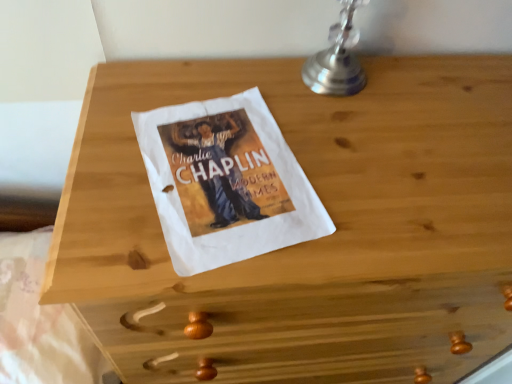
Question: Should I look upward or downward to see white paper at lower center?

Choices:
 (A) down
 (B) up

Answer: (A)

Question: Is white paper at lower center touching silver metallic table lamp at upper right?

Choices:
 (A) yes
 (B) no

Answer: (B)

Question: From the image's perspective, is white paper at lower center below silver metallic table lamp at upper right?

Choices:
 (A) no
 (B) yes

Answer: (B)

Question: From the image's perspective, is white paper at lower center on silver metallic table lamp at upper right?

Choices:
 (A) no
 (B) yes

Answer: (A)

Question: Can you confirm if white paper at lower center is bigger than silver metallic table lamp at upper right?

Choices:
 (A) yes
 (B) no

Answer: (A)

Question: Is there a large distance between white paper at lower center and silver metallic table lamp at upper right?

Choices:
 (A) no
 (B) yes

Answer: (A)

Question: Is white paper at lower center smaller than silver metallic table lamp at upper right?

Choices:
 (A) no
 (B) yes

Answer: (A)

Question: Is the depth of silver metallic table lamp at upper right greater than that of white paper at lower center?

Choices:
 (A) yes
 (B) no

Answer: (B)

Question: Does silver metallic table lamp at upper right have a greater height compared to white paper at lower center?

Choices:
 (A) no
 (B) yes

Answer: (B)

Question: From the image's perspective, is silver metallic table lamp at upper right under white paper at lower center?

Choices:
 (A) yes
 (B) no

Answer: (B)

Question: Does silver metallic table lamp at upper right appear on the right side of white paper at lower center?

Choices:
 (A) yes
 (B) no

Answer: (A)

Question: Would you say silver metallic table lamp at upper right is outside white paper at lower center?

Choices:
 (A) yes
 (B) no

Answer: (A)

Question: Can white paper at lower center be found inside silver metallic table lamp at upper right?

Choices:
 (A) yes
 (B) no

Answer: (B)

Question: Considering the positions of white paper at lower center and silver metallic table lamp at upper right in the image, is white paper at lower center taller or shorter than silver metallic table lamp at upper right?

Choices:
 (A) tall
 (B) short

Answer: (B)